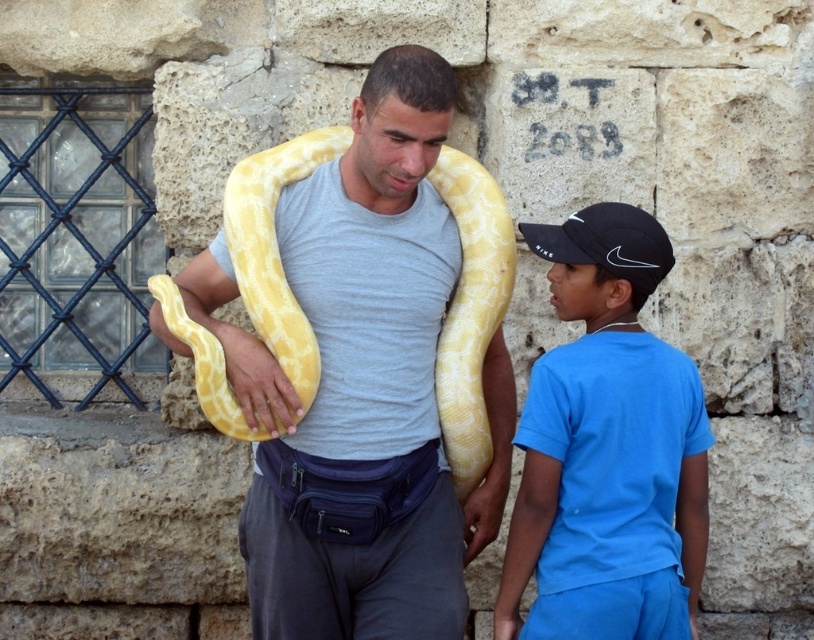
Question: Which point appears closest to the camera in this image?

Choices:
 (A) (624, 310)
 (B) (546, 589)

Answer: (B)

Question: Can you confirm if matte yellow snake at center is positioned above blue cotton shirt at right?

Choices:
 (A) yes
 (B) no

Answer: (B)

Question: Which point appears closest to the camera in this image?

Choices:
 (A) (357, 177)
 (B) (611, 324)

Answer: (B)

Question: In this image, where is yellow matte snake at center located relative to matte blue neck at upper center?

Choices:
 (A) right
 (B) left

Answer: (B)

Question: Considering the real-world distances, which object is farthest from the matte blue neck at upper center?

Choices:
 (A) blue cotton shirt at right
 (B) yellow matte snake at center
 (C) matte yellow snake at center

Answer: (C)

Question: Is matte yellow snake at center bigger than yellow matte snake at center?

Choices:
 (A) no
 (B) yes

Answer: (A)